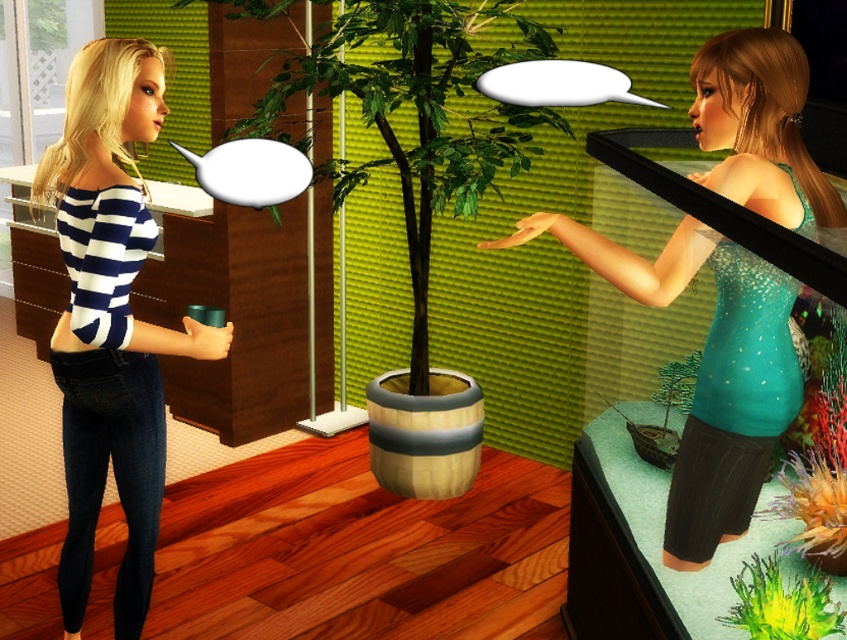
Question: Which point is closer to the camera?

Choices:
 (A) teal glitter tank top at center
 (B) green matte plant at lower right
 (C) denim jeans at left

Answer: (B)

Question: Which object is farther from the camera taking this photo?

Choices:
 (A) teal glitter tank top at center
 (B) green matte plant at lower right

Answer: (A)

Question: Does denim jeans at left appear on the right side of green matte plant at center?

Choices:
 (A) yes
 (B) no

Answer: (B)

Question: Is teal glitter tank top at center smaller than green matte plant at lower right?

Choices:
 (A) no
 (B) yes

Answer: (A)

Question: Is teal glitter tank top at center thinner than green matte plant at lower right?

Choices:
 (A) no
 (B) yes

Answer: (A)

Question: Considering the real-world distances, which object is closest to the teal glitter tank top at center?

Choices:
 (A) green matte plant at lower right
 (B) green matte plant at center

Answer: (B)